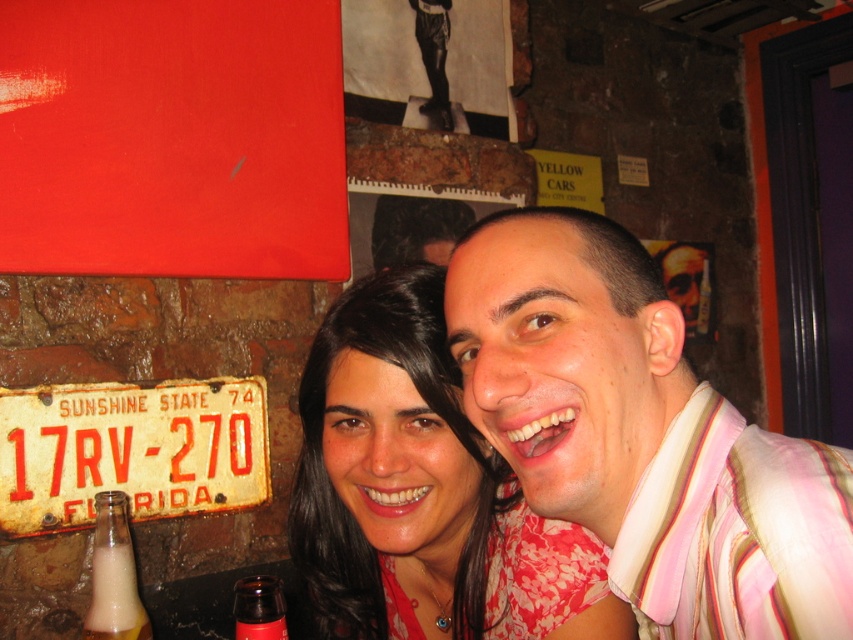
You are a photographer standing 20 inches away from the brick wall in the image. You want to take a closeup shot of the pink striped shirt at center. Is the shirt within your reach to focus on?

The pink striped shirt at center is 15.99 inches away from the viewer, so yes, it is within reach to focus on since it is closer than your 20 inches distance from the wall.

You are a photographer setting up a shot of the two people in the image. You notice the rusty metal license plate at lower left and the brown glass bottle at lower left. Since you want to focus on the people, you need to decide which object to move first. Based on their sizes, which one should you move first?

The rusty metal license plate at lower left is larger than the brown glass bottle at lower left, so you should move the rusty metal license plate at lower left first to avoid blocking the view of the people.

You are a photographer adjusting your camera to focus on the brown glass bottle at lower left. The rusty metal license plate at lower left is blocking your view. Can you move the license plate out of the way to get a clear shot of the bottle?

The rusty metal license plate at lower left is further to the viewer than brown glass bottle at lower left, so moving the license plate would allow you to see the bottle behind it.